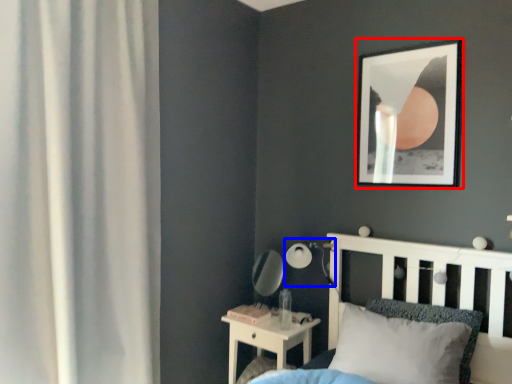
Question: Which point is closer to the camera, picture frame (highlighted by a red box) or table lamp (highlighted by a blue box)?

Choices:
 (A) picture frame
 (B) table lamp

Answer: (A)